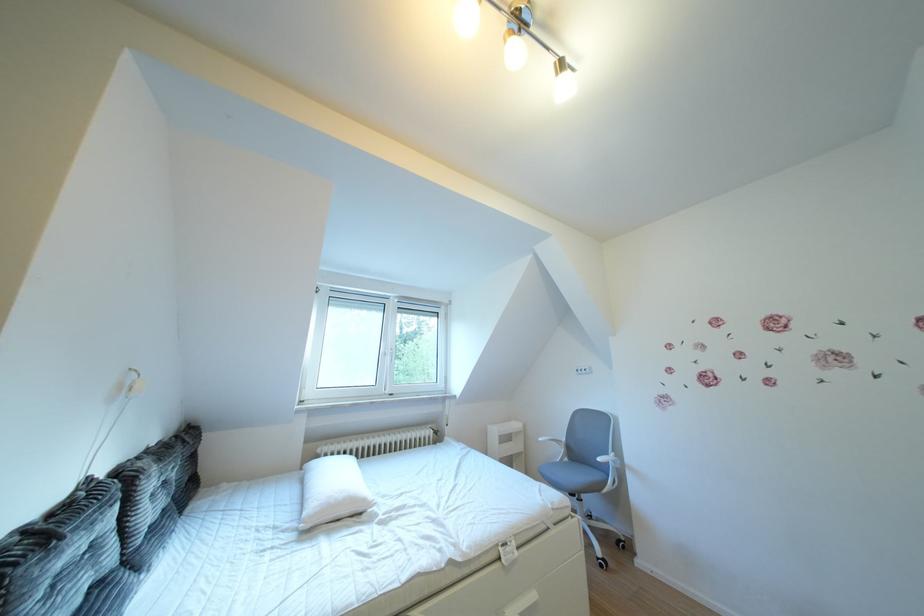
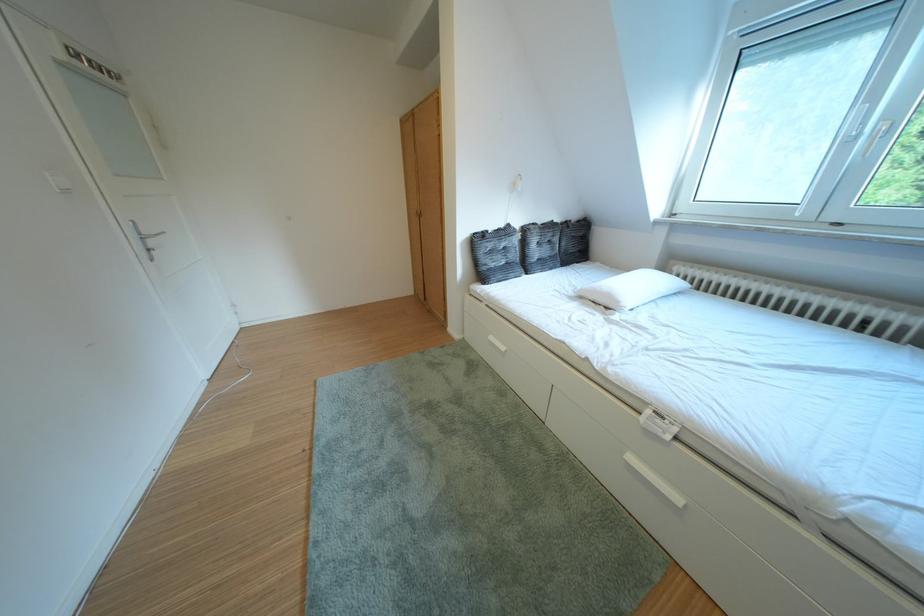
The point at (365, 505) is marked in the first image. Where is the corresponding point in the second image?

(623, 301)